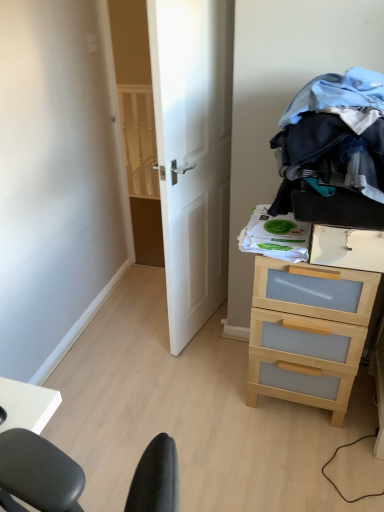
Locate an element on the screen. The height and width of the screenshot is (512, 384). vacant space situated on the left part of white wooden door at center is located at coordinates (132, 325).